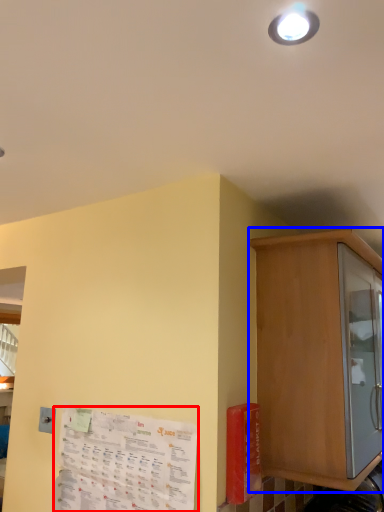
Question: Which object is closer to the camera taking this photo, paper (highlighted by a red box) or cabinetry (highlighted by a blue box)?

Choices:
 (A) paper
 (B) cabinetry

Answer: (A)